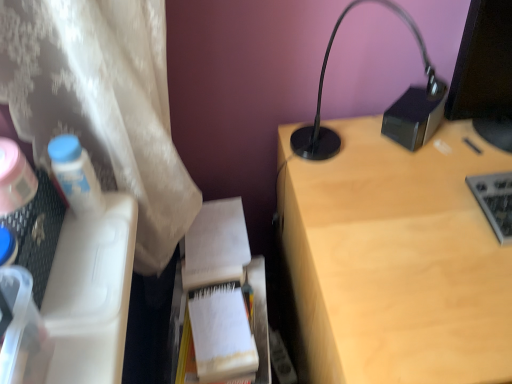
At what (x,y) coordinates should I click in order to perform the action: click on free region on the left part of gray metallic keyboard at right. Please return your answer as a coordinate pair (x, y). Looking at the image, I should click on (426, 222).